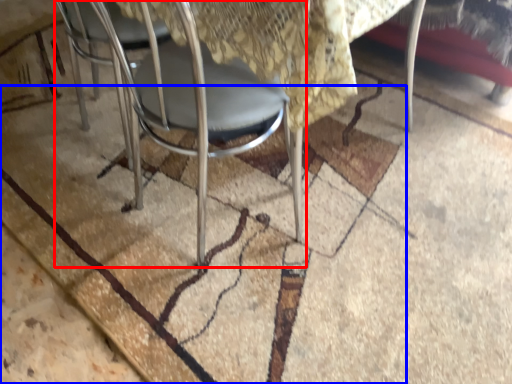
Question: Which of the following is the farthest to the observer, chair (highlighted by a red box) or mat (highlighted by a blue box)?

Choices:
 (A) chair
 (B) mat

Answer: (B)